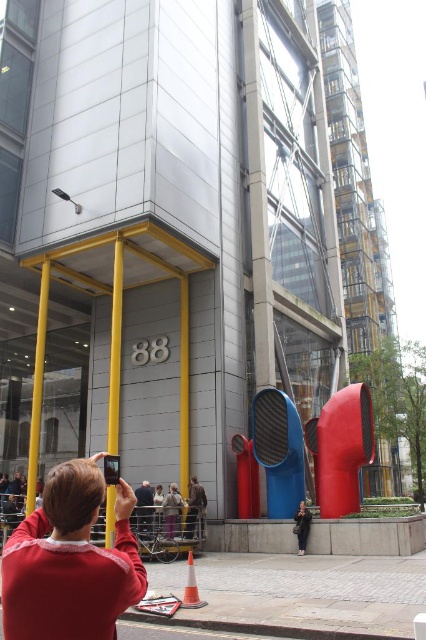
Can you confirm if matte brown jacket at center is wider than dark gray jacket at center?

Correct, the width of matte brown jacket at center exceeds that of dark gray jacket at center.

Who is higher up, matte brown jacket at center or dark gray jacket at center?

Positioned higher is matte brown jacket at center.

Which is behind, point (164, 506) or point (304, 538)?

Point (164, 506)

The image size is (426, 640). I want to click on matte brown jacket at center, so [172, 509].

Is point (193, 588) less distant than point (305, 536)?

Yes, point (193, 588) is in front of point (305, 536).

Is orange plastic traffic cone at lower center positioned at the back of dark gray jacket at center?

No.

Does point (201, 605) come behind point (299, 518)?

No, (201, 605) is in front of (299, 518).

This screenshot has width=426, height=640. I want to click on orange plastic traffic cone at lower center, so (190, 586).

Does red fabric selfie at lower left have a smaller size compared to orange plastic traffic cone at lower center?

Actually, red fabric selfie at lower left might be larger than orange plastic traffic cone at lower center.

What do you see at coordinates (71, 561) in the screenshot? The height and width of the screenshot is (640, 426). I see `red fabric selfie at lower left` at bounding box center [71, 561].

This screenshot has width=426, height=640. I want to click on red fabric selfie at lower left, so click(x=71, y=561).

This screenshot has height=640, width=426. Find the location of `red fabric selfie at lower left`. red fabric selfie at lower left is located at coordinates (71, 561).